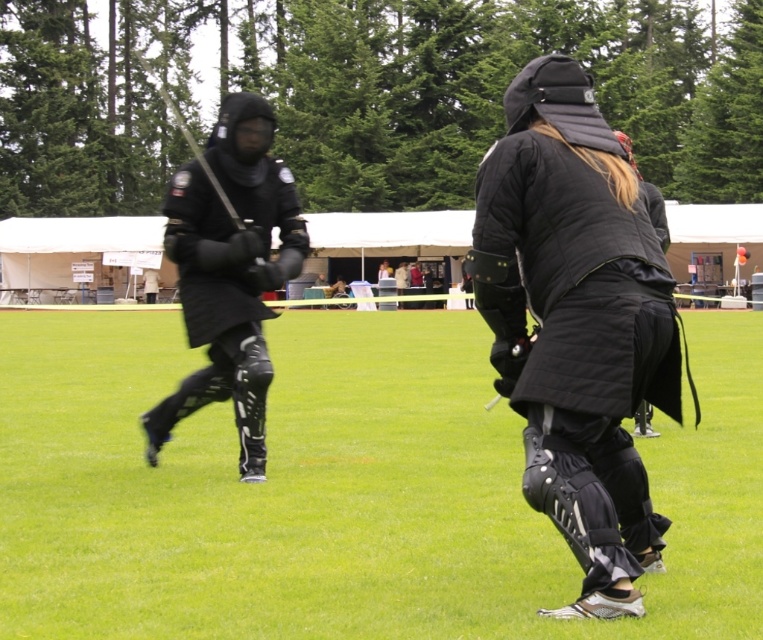
You are organizing a medieval fair and need to know which of the two items, the matte black armor at left or the matte black jacket at center, can accommodate a larger participant. Based on the scene description, which one would you choose?

The matte black armor at left is larger in size than the matte black jacket at center, so it can accommodate a larger participant.

You are a photographer setting up a tripod to capture the medieval combat demonstration. You need to position the camera so that both the matte black armor at left and the matte black jacket at center are fully visible. Given their heights, which object should you ensure is not blocking the view of the other?

The matte black armor at left is taller than the matte black jacket at center. Therefore, you should ensure the matte black armor at left does not block the view of the matte black jacket at center.